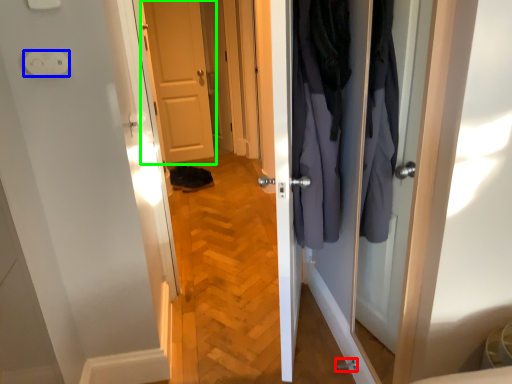
Question: Which object is the farthest from door handle (highlighted by a red box)? Choose among these: electric outlet (highlighted by a blue box) or door (highlighted by a green box).

Choices:
 (A) electric outlet
 (B) door

Answer: (B)